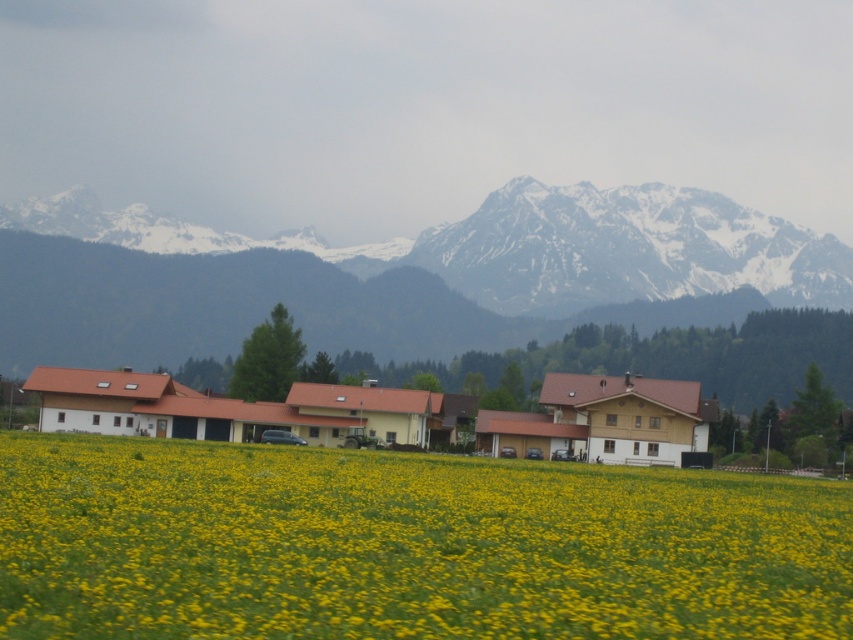
You are standing in the rural landscape and want to take a photo that includes both the yellow grass at center and the snowy rock mountain range at upper center. Which object should you focus on first to ensure both are in sharp focus?

You should focus on the snowy rock mountain range at upper center first because it is farther away than the yellow grass at center, ensuring both will be in focus when using depth of field properly.

You are standing at the center of the image and want to walk towards the yellow grass at center. Which direction should you go?

Since the yellow grass at center is located at point 0.853 on the x axis and 0.476 on the y axis, you should move forward to reach it as it is already centered in your view.